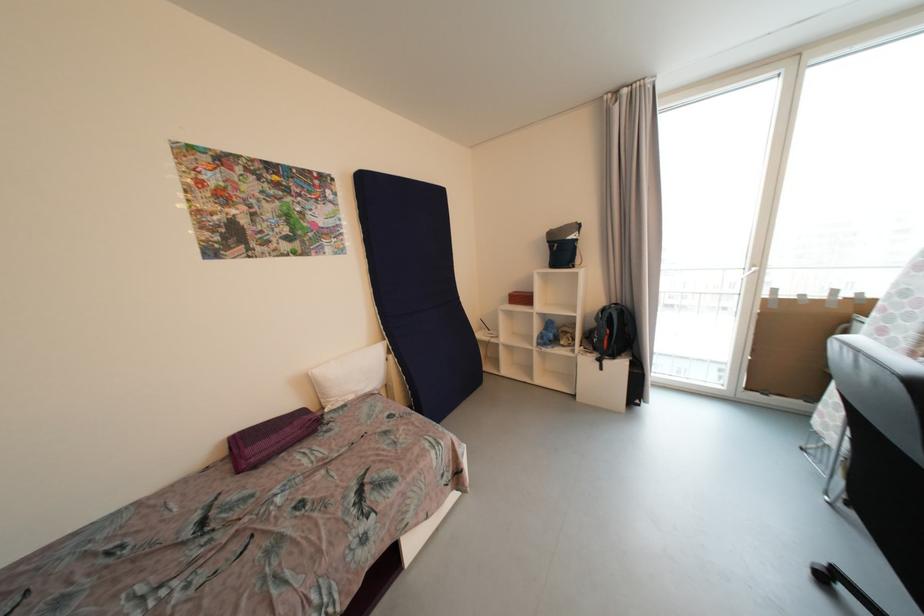
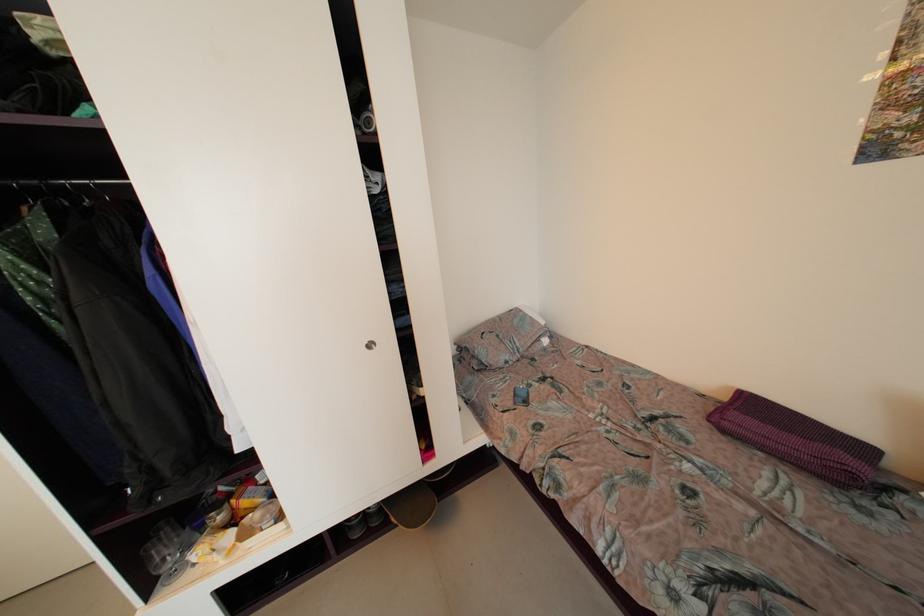
How did the camera likely rotate?

The camera's rotation is toward left-down.